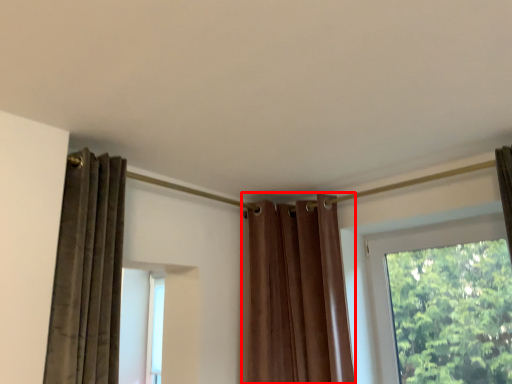
Question: From the image's perspective, where is curtain (annotated by the red box) located in relation to window in the image?

Choices:
 (A) below
 (B) above

Answer: (B)